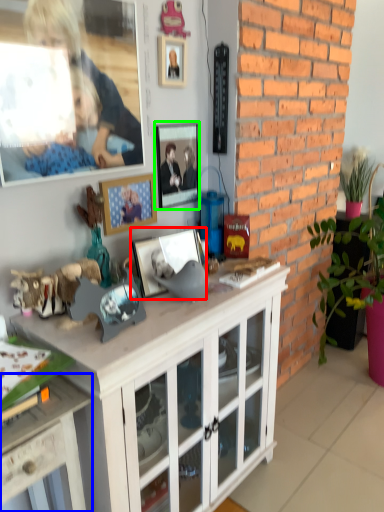
Question: Which is farther away from picture frame (highlighted by a red box)? desk (highlighted by a blue box) or picture frame (highlighted by a green box)?

Choices:
 (A) desk
 (B) picture frame

Answer: (A)